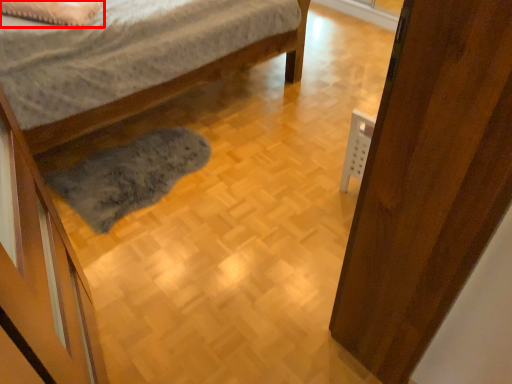
Question: In this image, where is pillow (annotated by the red box) located relative to door?

Choices:
 (A) left
 (B) right

Answer: (A)